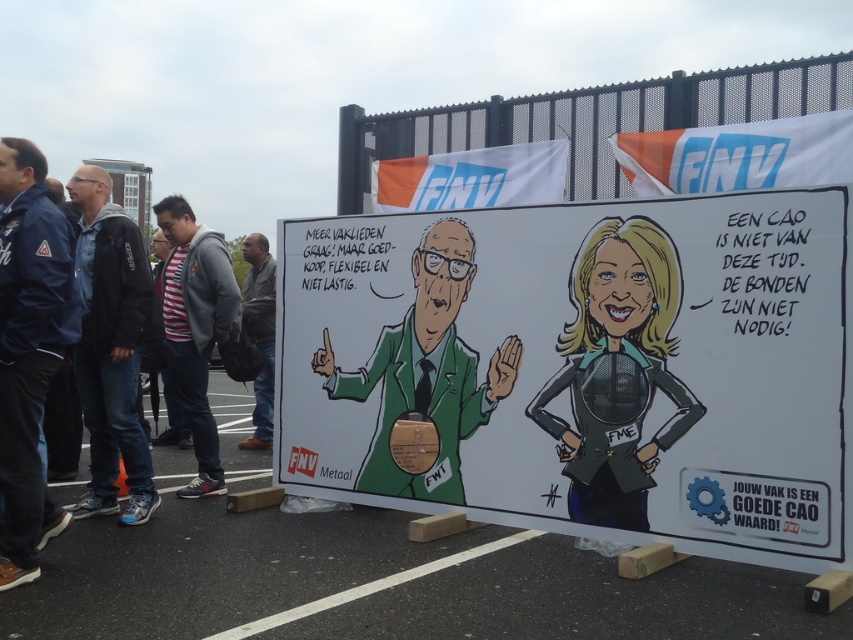
Can you confirm if white paper signboard at center is bigger than gray fleece jacket at left?

Actually, white paper signboard at center might be smaller than gray fleece jacket at left.

Between white paper signboard at center and gray fleece jacket at left, which one appears on the left side from the viewer's perspective?

gray fleece jacket at left

In order to click on white paper signboard at center in this screenshot , I will do `click(376, 580)`.

Where is `white paper signboard at center`? The height and width of the screenshot is (640, 853). white paper signboard at center is located at coordinates (376, 580).

Who is lower down, blue fabric jacket at left or gray fleece jacket at left?

Positioned lower is gray fleece jacket at left.

Does blue fabric jacket at left appear on the left side of gray fleece jacket at left?

Correct, you'll find blue fabric jacket at left to the left of gray fleece jacket at left.

Between point (4, 182) and point (177, 346), which one is positioned in front?

Point (4, 182) is more forward.

I want to click on blue fabric jacket at left, so pos(28,349).

Can you confirm if black jacket at left is taller than gray fleece jacket at left?

Indeed, black jacket at left has a greater height compared to gray fleece jacket at left.

This screenshot has width=853, height=640. I want to click on black jacket at left, so click(111, 348).

Between point (105, 228) and point (215, 333), which one is positioned behind?

Positioned behind is point (215, 333).

Find the location of a particular element. black jacket at left is located at coordinates (111, 348).